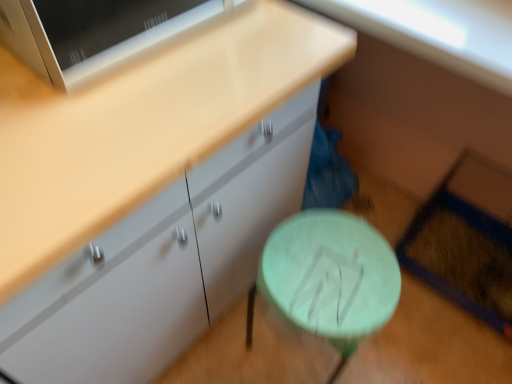
Question: Choose the correct answer: Is green matte table at lower center inside matte white cabinet at center or outside it?

Choices:
 (A) inside
 (B) outside

Answer: (B)

Question: From a real-world perspective, is green matte table at lower center physically located above or below matte white cabinet at center?

Choices:
 (A) below
 (B) above

Answer: (A)

Question: Is point (391, 281) positioned closer to the camera than point (267, 190)?

Choices:
 (A) farther
 (B) closer

Answer: (B)

Question: Is matte white cabinet at center in front of or behind green matte table at lower center in the image?

Choices:
 (A) behind
 (B) front

Answer: (B)

Question: In the image, is matte white cabinet at center on the left side or the right side of green matte table at lower center?

Choices:
 (A) right
 (B) left

Answer: (B)

Question: From a real-world perspective, is matte white cabinet at center above or below green matte table at lower center?

Choices:
 (A) above
 (B) below

Answer: (A)

Question: Which is correct: matte white cabinet at center is inside green matte table at lower center, or outside of it?

Choices:
 (A) inside
 (B) outside

Answer: (B)